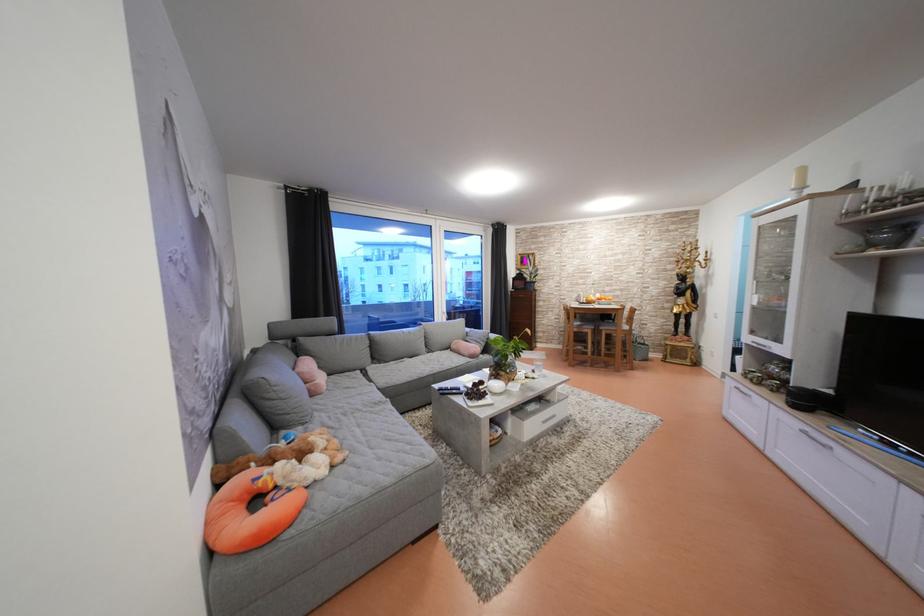
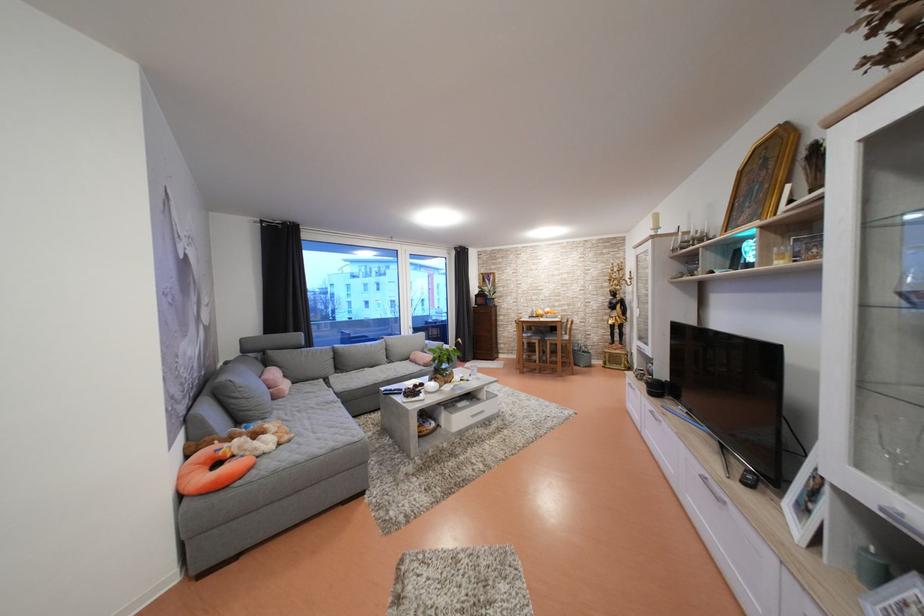
Where in the second image is the point corresponding to (x=600, y=333) from the first image?

(545, 342)